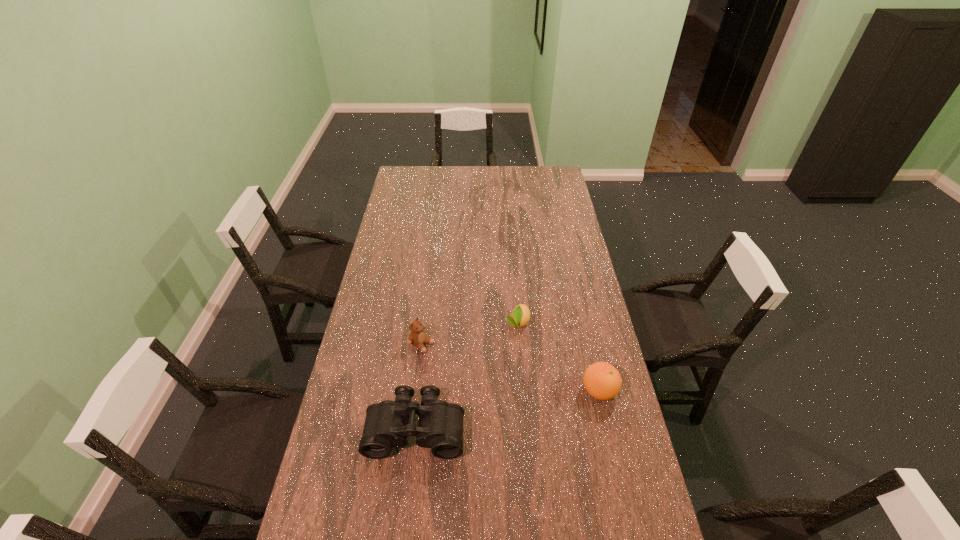
Locate an element on the screen. Image resolution: width=960 pixels, height=540 pixels. vacant space that is in between the lemon and the binoculars is located at coordinates (468, 376).

The height and width of the screenshot is (540, 960). I want to click on empty space that is in between the binoculars and the teddy bear, so click(x=419, y=386).

What are the coordinates of `vacant region between the orange and the teddy bear` in the screenshot? It's located at point(511,367).

This screenshot has height=540, width=960. What are the coordinates of `vacant area that lies between the orange and the binoculars` in the screenshot? It's located at (508, 410).

Locate an element on the screen. free space between the second object from right to left and the binoculars is located at coordinates (468, 376).

Where is `free spot between the rightmost object and the lemon`? The image size is (960, 540). free spot between the rightmost object and the lemon is located at coordinates (559, 357).

Find the location of `free space between the rightmost object and the binoculars`. free space between the rightmost object and the binoculars is located at coordinates (508, 410).

Identify the location of free area in between the orange and the binoculars. (508, 410).

Select which object is the third closest to the orange. Please provide its 2D coordinates. Your answer should be formatted as a tuple, i.e. [(x, y)], where the tuple contains the x and y coordinates of a point satisfying the conditions above.

[(417, 337)]

In order to click on object identified as the third closest to the rightmost object in this screenshot , I will do `click(417, 337)`.